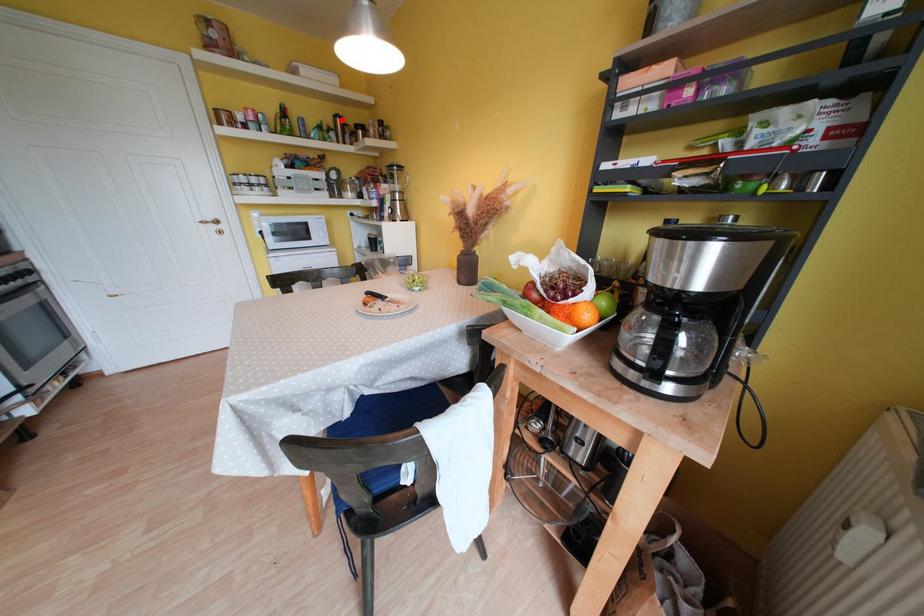
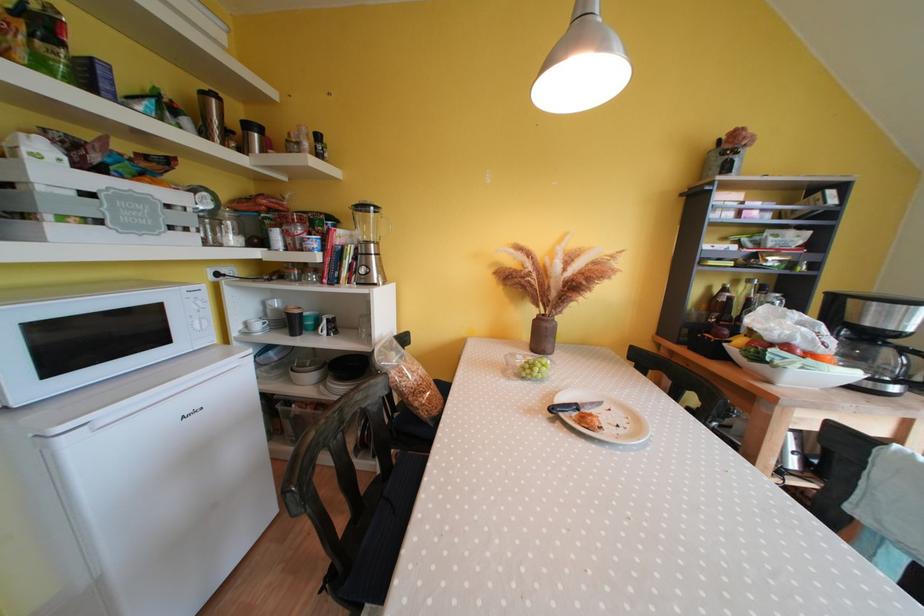
Find the pixel in the second image that matches the highlighted location in the first image.

(209, 98)